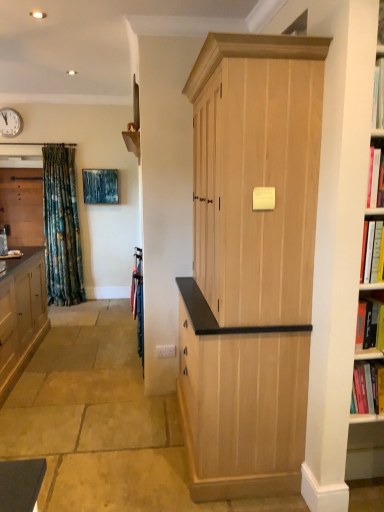
Question: Does natural wood cabinet at center, arranged as the third cabinetry when viewed from the back, have a smaller size compared to metallic wall clock at upper left?

Choices:
 (A) yes
 (B) no

Answer: (B)

Question: From the image's perspective, would you say natural wood cabinet at center, positioned as the 3th cabinetry in left-to-right order, is shown under metallic wall clock at upper left?

Choices:
 (A) yes
 (B) no

Answer: (A)

Question: Can you confirm if natural wood cabinet at center, which is counted as the first cabinetry, starting from the right, is taller than metallic wall clock at upper left?

Choices:
 (A) no
 (B) yes

Answer: (B)

Question: From a real-world perspective, is natural wood cabinet at center, positioned as the 3th cabinetry in left-to-right order, positioned over metallic wall clock at upper left based on gravity?

Choices:
 (A) no
 (B) yes

Answer: (A)

Question: Is natural wood cabinet at center, arranged as the third cabinetry when viewed from the back, next to metallic wall clock at upper left and touching it?

Choices:
 (A) yes
 (B) no

Answer: (B)

Question: From their relative heights in the image, would you say metallic wall clock at upper left is taller or shorter than natural wood cabinet at center, positioned as the 3th cabinetry in left-to-right order?

Choices:
 (A) short
 (B) tall

Answer: (A)

Question: From the image's perspective, is metallic wall clock at upper left located above or below natural wood cabinet at center, which is counted as the first cabinetry, starting from the right?

Choices:
 (A) above
 (B) below

Answer: (A)

Question: Does point (9, 129) appear closer or farther from the camera than point (316, 164)?

Choices:
 (A) closer
 (B) farther

Answer: (B)

Question: Is metallic wall clock at upper left to the left or to the right of natural wood cabinet at center, which is counted as the first cabinetry, starting from the right, in the image?

Choices:
 (A) left
 (B) right

Answer: (A)

Question: Considering the positions of matte wood cabinet at left, positioned as the 2th cabinetry in right-to-left order, and metallic wall clock at upper left in the image, is matte wood cabinet at left, positioned as the 2th cabinetry in right-to-left order, bigger or smaller than metallic wall clock at upper left?

Choices:
 (A) big
 (B) small

Answer: (A)

Question: Is matte wood cabinet at left, which is the second cabinetry in back-to-front order, inside or outside of metallic wall clock at upper left?

Choices:
 (A) inside
 (B) outside

Answer: (B)

Question: From their relative heights in the image, would you say matte wood cabinet at left, positioned as the 2th cabinetry in right-to-left order, is taller or shorter than metallic wall clock at upper left?

Choices:
 (A) tall
 (B) short

Answer: (A)

Question: Is matte wood cabinet at left, placed as the 2th cabinetry when sorted from front to back, in front of or behind metallic wall clock at upper left in the image?

Choices:
 (A) front
 (B) behind

Answer: (A)

Question: Is matte wood cabinet at left, positioned as the 2th cabinetry in left-to-right order, taller or shorter than wooden shelf at upper center?

Choices:
 (A) short
 (B) tall

Answer: (B)

Question: From the image's perspective, is matte wood cabinet at left, positioned as the 2th cabinetry in right-to-left order, located above or below wooden shelf at upper center?

Choices:
 (A) above
 (B) below

Answer: (B)